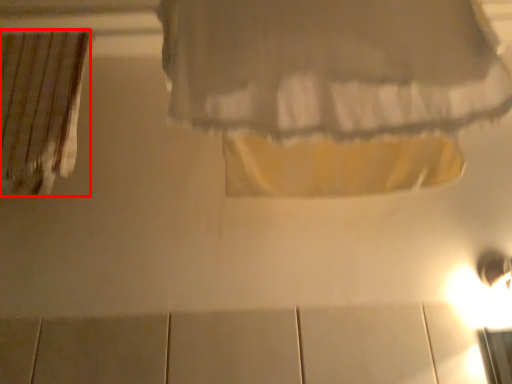
Question: From the image, what is the correct spatial relationship of curtain (annotated by the red box) in relation to curtain?

Choices:
 (A) left
 (B) right

Answer: (A)